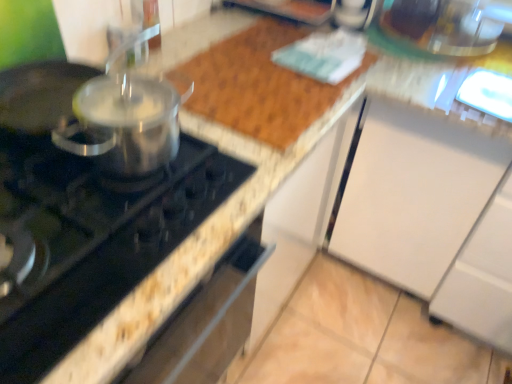
Question: Considering the relative positions of metallic silver pot at left and black glass gas stove at left in the image provided, is metallic silver pot at left in front of black glass gas stove at left?

Choices:
 (A) no
 (B) yes

Answer: (A)

Question: Can you confirm if metallic silver pot at left is wider than black glass gas stove at left?

Choices:
 (A) no
 (B) yes

Answer: (A)

Question: Does metallic silver pot at left have a smaller size compared to black glass gas stove at left?

Choices:
 (A) no
 (B) yes

Answer: (B)

Question: Does metallic silver pot at left have a greater height compared to black glass gas stove at left?

Choices:
 (A) no
 (B) yes

Answer: (B)

Question: Does metallic silver pot at left appear on the right side of black glass gas stove at left?

Choices:
 (A) yes
 (B) no

Answer: (B)

Question: From a real-world perspective, does metallic silver pot at left stand above black glass gas stove at left?

Choices:
 (A) yes
 (B) no

Answer: (A)

Question: Is the position of black glass gas stove at left more distant than that of metallic silver pot at left?

Choices:
 (A) no
 (B) yes

Answer: (A)

Question: Is black glass gas stove at left positioned with its back to metallic silver pot at left?

Choices:
 (A) no
 (B) yes

Answer: (A)

Question: Is metallic silver pot at left completely or partially inside black glass gas stove at left?

Choices:
 (A) no
 (B) yes

Answer: (A)

Question: Is black glass gas stove at left bigger than metallic silver pot at left?

Choices:
 (A) yes
 (B) no

Answer: (A)

Question: Is black glass gas stove at left at the right side of metallic silver pot at left?

Choices:
 (A) yes
 (B) no

Answer: (A)

Question: From a real-world perspective, is black glass gas stove at left under metallic silver pot at left?

Choices:
 (A) yes
 (B) no

Answer: (A)

Question: Choose the correct answer: Is black glass gas stove at left inside metallic silver pot at left or outside it?

Choices:
 (A) inside
 (B) outside

Answer: (B)